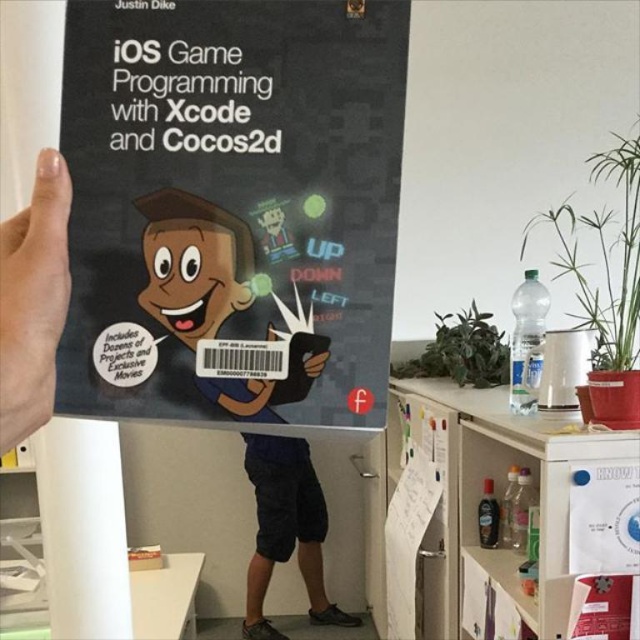
Looking at the scene, which object is positioned to the right of the other between the smooth skin hand at upper left and the dark blue cotton shorts at lower center?

The smooth skin hand at upper left is to the right of the dark blue cotton shorts at lower center.

Looking at this image, you are a person in the office and you see two points in the image, point (67, 438) and point (49, 349). Which point is closer to you?

Point (67, 438) is further to the viewer than point (49, 349), so the point closer to you is point (49, 349).

You are organizing a bookshelf and have a matte black book at upper center and a white paper at lower left. Which item should you place first if you want to arrange items from largest to smallest?

You should place the white paper at lower left first because it is larger than the matte black book at upper center.